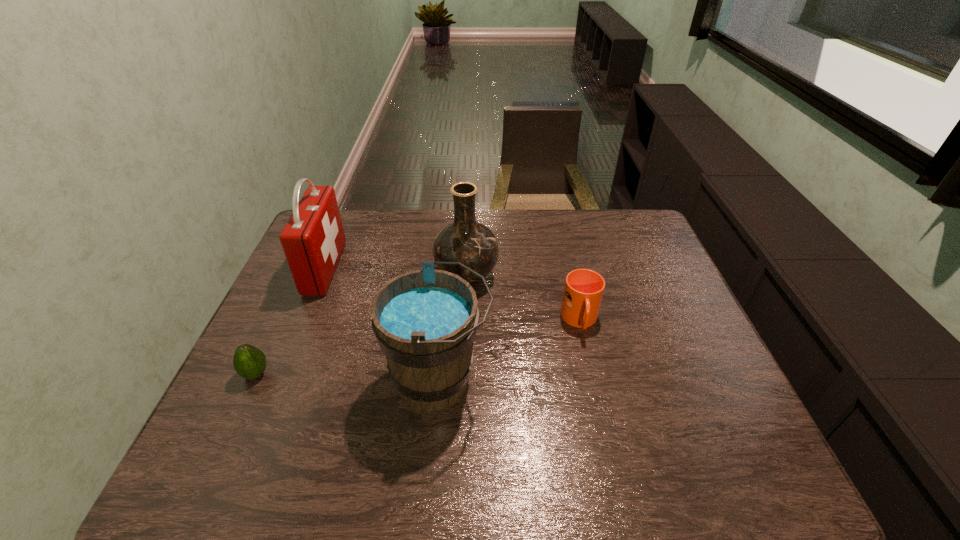
Where is `vase`? This screenshot has height=540, width=960. vase is located at coordinates (471, 243).

The width and height of the screenshot is (960, 540). In order to click on the first-aid kit in this screenshot , I will do `click(313, 239)`.

Identify the location of wine bucket. (425, 321).

The height and width of the screenshot is (540, 960). I want to click on the second shortest object, so click(x=583, y=291).

Image resolution: width=960 pixels, height=540 pixels. Find the location of `the third nearest object`. the third nearest object is located at coordinates (583, 291).

Locate an element on the screen. avocado is located at coordinates (249, 362).

This screenshot has width=960, height=540. Identify the location of vacant space located on the left of the vase. (349, 275).

What are the coordinates of `blank space located on the front face of the first-aid kit` in the screenshot? It's located at (447, 268).

Where is `free space located with a handle on the side of the wine bucket`? The width and height of the screenshot is (960, 540). free space located with a handle on the side of the wine bucket is located at coordinates (633, 380).

Identify the location of vacant space located on the handle side of the third farthest object. (600, 405).